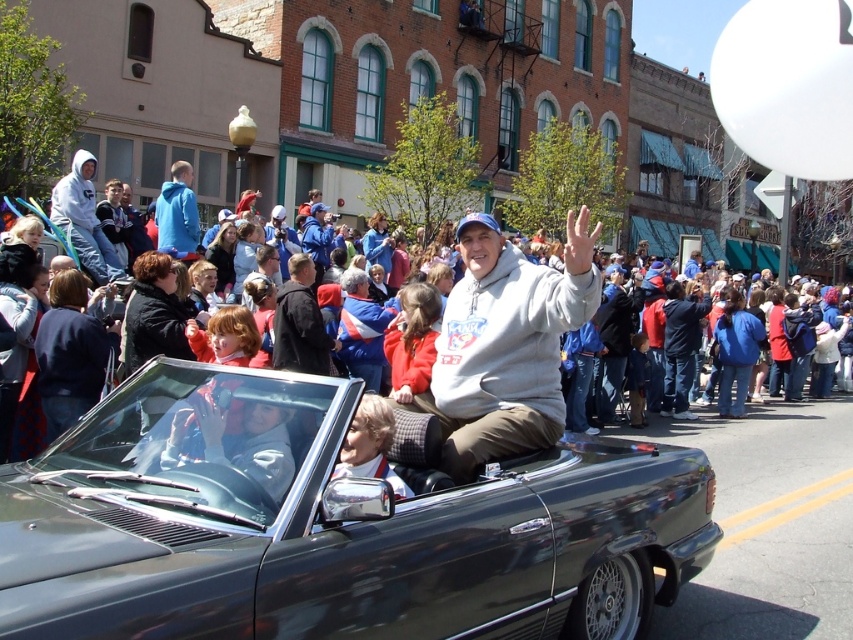
You are standing at the origin point in the parade scene. The shiny black convertible at center is located at point (329,525). Can you determine the direction of the shiny black convertible at center relative to your position?

The shiny black convertible at center is located at point (329,525), which means it is to the northeast of your position since the coordinates are both greater than 0.5.

You are standing at the point labeled as point [664,488] in the image. You want to throw a balloon to a friend who is 4 meters away from you. Is your friend within reach?

The distance between point [664,488] and the viewer is 3.96 meters, so yes, the friend is within reach since the distance is just under 4 meters.

What is located at the coordinates point [329,525] in the image?

The shiny black convertible at center is located at point [329,525].